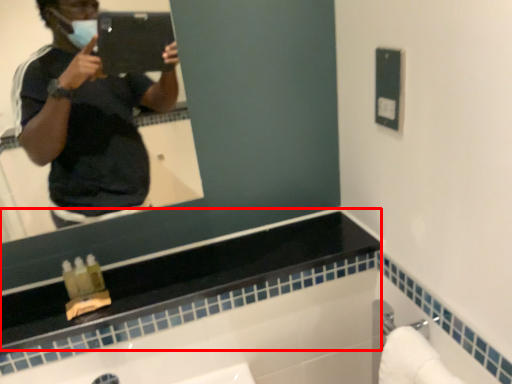
Question: In this image, where is counter top (annotated by the red box) located relative to towel bar?

Choices:
 (A) right
 (B) left

Answer: (B)